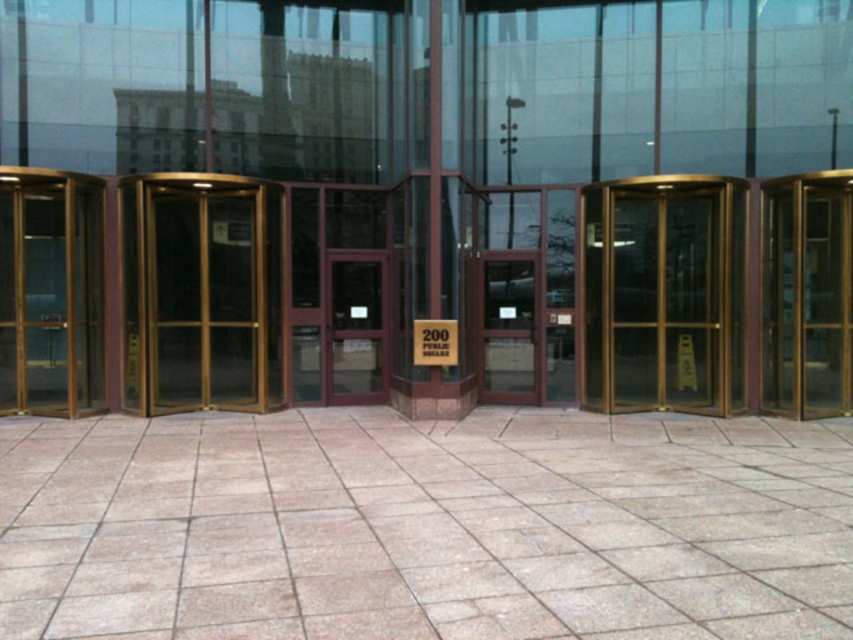
You are standing at the entrance of the building and want to enter. The gold reflective glass door at center and the mahogany wood door at center are both in front of you. Which door should you push to enter the building?

The mahogany wood door at center is the one you should push to enter because the gold reflective glass door at center is above it and likely part of the revolving doors structure, while the mahogany wood door at center is the main entrance door at ground level.

You are a delivery person trying to locate the office number 200. You see a matte glass door at center and a white paper sign at center. Which object should you look at to find the office number?

The white paper sign at center displays the number 200, so you should look at the white paper sign at center to find the office number.

You are a delivery person trying to locate the office number 200. You see the matte glass door at center and the white paper sign at center. Which object is closer to you, the delivery person?

The white paper sign at center is behind the matte glass door at center, so the matte glass door at center is closer to you than the white paper sign at center.